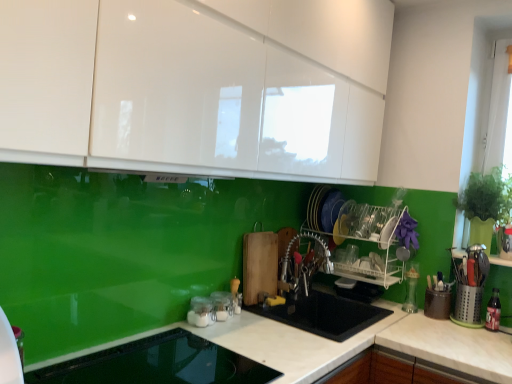
Question: Can you confirm if clear glass jars at lower center, which is counted as the second appliance, starting from the front, is smaller than white plastic dish rack at center, placed as the sixth appliance when sorted from front to back?

Choices:
 (A) no
 (B) yes

Answer: (B)

Question: Is clear glass jars at lower center, which is counted as the 5th appliance, starting from the back, aimed at white plastic dish rack at center, the first appliance in the back-to-front sequence?

Choices:
 (A) no
 (B) yes

Answer: (A)

Question: From the image's perspective, is clear glass jars at lower center, the second appliance in the left-to-right sequence, on white plastic dish rack at center, which is the 4th appliance from left to right?

Choices:
 (A) no
 (B) yes

Answer: (A)

Question: From a real-world perspective, is clear glass jars at lower center, which is counted as the second appliance, starting from the front, positioned over white plastic dish rack at center, which is the 4th appliance from left to right, based on gravity?

Choices:
 (A) no
 (B) yes

Answer: (A)

Question: Does clear glass jars at lower center, which is counted as the 5th appliance, starting from the back, come behind white plastic dish rack at center, which is the 4th appliance from left to right?

Choices:
 (A) yes
 (B) no

Answer: (B)

Question: Considering the positions of clear glass jars at center, positioned as the 3th appliance in left-to-right order, and white glossy countertop at center in the image, is clear glass jars at center, positioned as the 3th appliance in left-to-right order, bigger or smaller than white glossy countertop at center?

Choices:
 (A) small
 (B) big

Answer: (A)

Question: From the image's perspective, is clear glass jars at center, the fourth appliance from the right, above or below white glossy countertop at center?

Choices:
 (A) above
 (B) below

Answer: (A)

Question: Considering the positions of clear glass jars at center, positioned as the 3th appliance in left-to-right order, and white glossy countertop at center in the image, is clear glass jars at center, positioned as the 3th appliance in left-to-right order, taller or shorter than white glossy countertop at center?

Choices:
 (A) short
 (B) tall

Answer: (A)

Question: Does point (215, 301) appear closer or farther from the camera than point (464, 360)?

Choices:
 (A) farther
 (B) closer

Answer: (A)

Question: Is white glossy cabinets at upper center wider or thinner than metallic silver utensils at center?

Choices:
 (A) thin
 (B) wide

Answer: (B)

Question: Based on their sizes in the image, would you say white glossy cabinets at upper center is bigger or smaller than metallic silver utensils at center?

Choices:
 (A) small
 (B) big

Answer: (B)

Question: Does point (8, 61) appear closer or farther from the camera than point (305, 236)?

Choices:
 (A) closer
 (B) farther

Answer: (A)

Question: Relative to metallic silver utensils at center, is white glossy cabinets at upper center in front or behind?

Choices:
 (A) front
 (B) behind

Answer: (A)

Question: From the image's perspective, relative to clear glass jars at center, positioned as the 3th appliance in left-to-right order, is white plastic dish rack at center, placed as the sixth appliance when sorted from front to back, above or below?

Choices:
 (A) above
 (B) below

Answer: (A)

Question: Relative to clear glass jars at center, marked as the 3th appliance in a front-to-back arrangement, is white plastic dish rack at center, which is the 4th appliance from left to right, in front or behind?

Choices:
 (A) behind
 (B) front

Answer: (A)